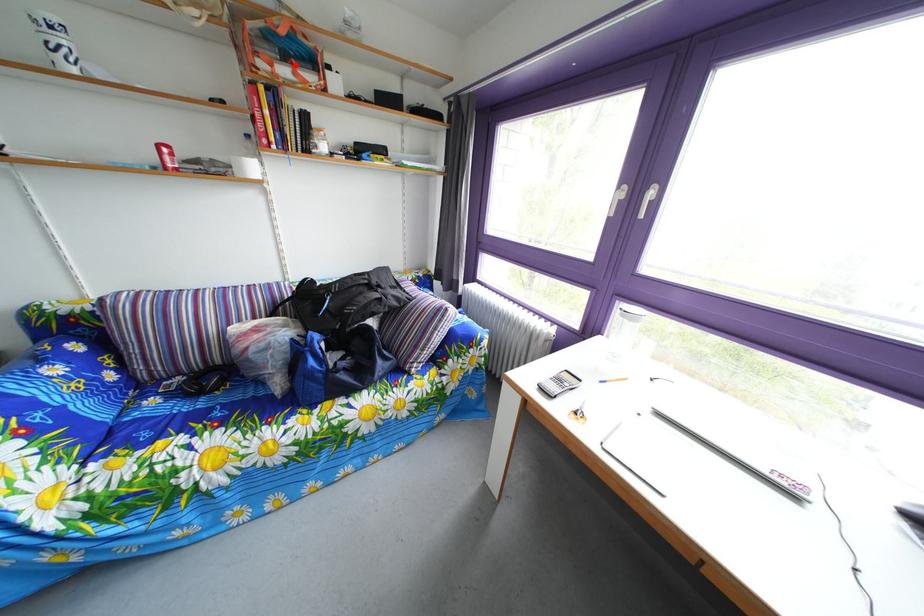
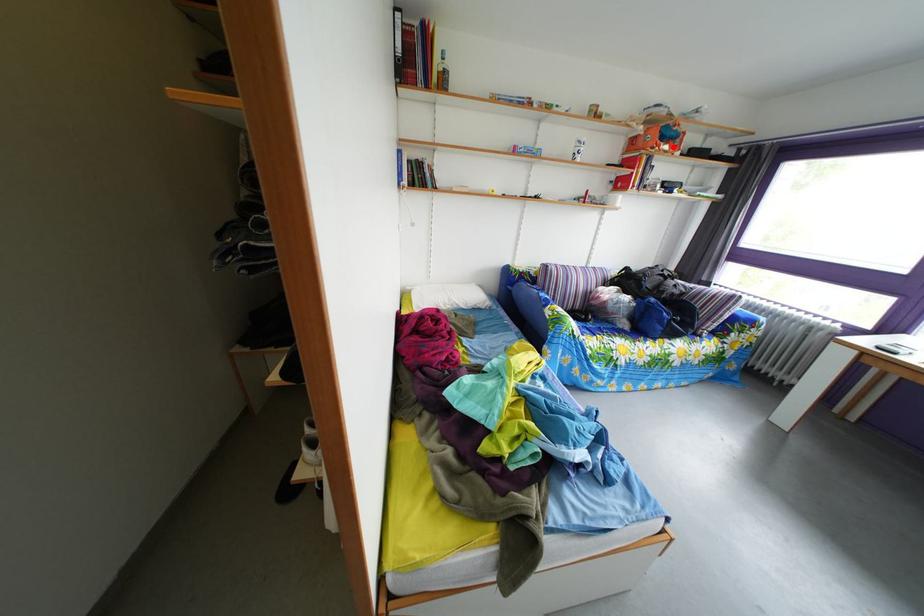
I am providing you with two images of the same scene from different viewpoints. A red point is marked on the first image and another point is marked on the second image. Is the marked point in image1 the same physical position as the marked point in image2?

Yes